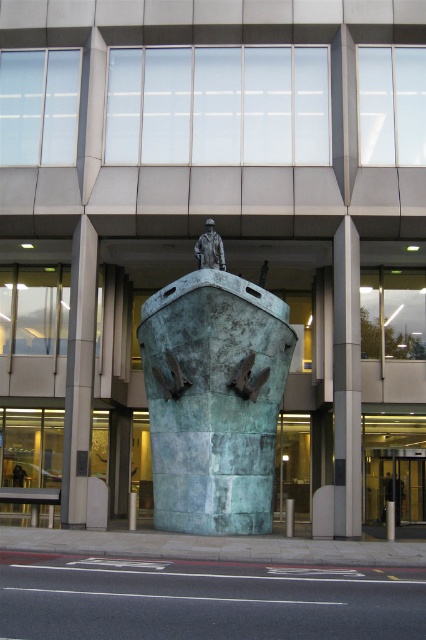
You are a GUI agent. You are given a task and a screenshot of the screen. Output one action in this format:
    pyautogui.click(x=<x>, y=<y>)
    Task: Click on the green patina ship at center
    The image size is (426, 640).
    Given the screenshot: What is the action you would take?
    pyautogui.click(x=213, y=401)

Can you confirm if green patina ship at center is thinner than smooth gray pillar at center?

Incorrect, green patina ship at center's width is not less than smooth gray pillar at center's.

This screenshot has height=640, width=426. In order to click on green patina ship at center in this screenshot , I will do `click(213, 401)`.

Does green patina pillar at center appear on the right side of bronze statue at center?

Incorrect, green patina pillar at center is not on the right side of bronze statue at center.

Between point (81, 492) and point (195, 256), which one is positioned behind?

The point (195, 256) is behind.

The image size is (426, 640). What are the coordinates of `green patina pillar at center` in the screenshot? It's located at point(78,376).

From the picture: Who is more forward, (164, 378) or (196, 241)?

Positioned in front is point (164, 378).

Does green patina ship at center have a greater height compared to bronze statue at center?

No, green patina ship at center is not taller than bronze statue at center.

Locate an element on the screen. This screenshot has height=640, width=426. green patina ship at center is located at coordinates (213, 401).